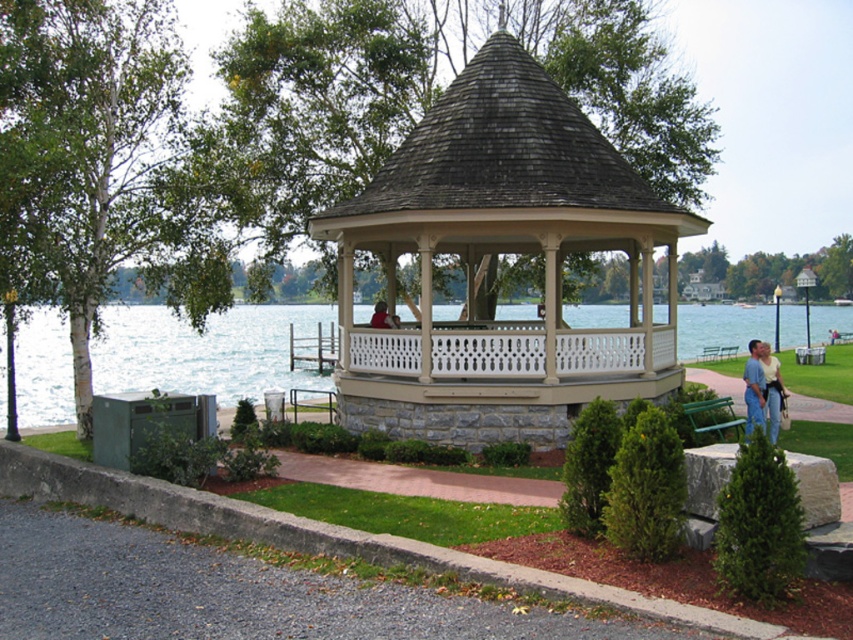
Can you confirm if beige wood gazebo at center is wider than blue jeans at center?

No, beige wood gazebo at center is not wider than blue jeans at center.

Is beige wood gazebo at center further to the viewer compared to blue jeans at center?

Yes.

The image size is (853, 640). What do you see at coordinates (502, 253) in the screenshot?
I see `beige wood gazebo at center` at bounding box center [502, 253].

Locate an element on the screen. Image resolution: width=853 pixels, height=640 pixels. beige wood gazebo at center is located at coordinates (502, 253).

Can you confirm if green painted wood bench at lower right is positioned to the left of light blue jeans at lower right?

Correct, you'll find green painted wood bench at lower right to the left of light blue jeans at lower right.

Can you confirm if green painted wood bench at lower right is wider than light blue jeans at lower right?

Incorrect, green painted wood bench at lower right's width does not surpass light blue jeans at lower right's.

Where is `green painted wood bench at lower right`? This screenshot has height=640, width=853. green painted wood bench at lower right is located at coordinates (712, 416).

Does light blue jeans at lower right have a larger size compared to red shirt at center?

Correct, light blue jeans at lower right is larger in size than red shirt at center.

Looking at this image, can you confirm if light blue jeans at lower right is wider than red shirt at center?

Yes, light blue jeans at lower right is wider than red shirt at center.

Find the location of `light blue jeans at lower right`. light blue jeans at lower right is located at coordinates (772, 392).

Image resolution: width=853 pixels, height=640 pixels. What are the coordinates of `light blue jeans at lower right` in the screenshot? It's located at (772, 392).